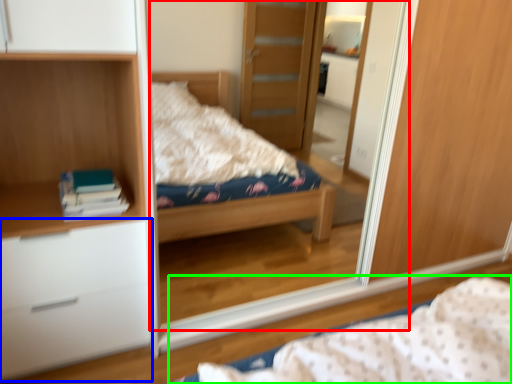
Question: Considering the real-world distances, which object is farthest from mirror (highlighted by a red box)? chest of drawers (highlighted by a blue box) or bed (highlighted by a green box)?

Choices:
 (A) chest of drawers
 (B) bed

Answer: (B)